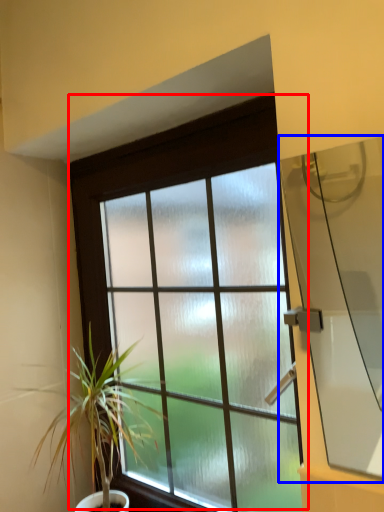
Question: Which object is further to the camera taking this photo, window (highlighted by a red box) or window screen (highlighted by a blue box)?

Choices:
 (A) window
 (B) window screen

Answer: (A)